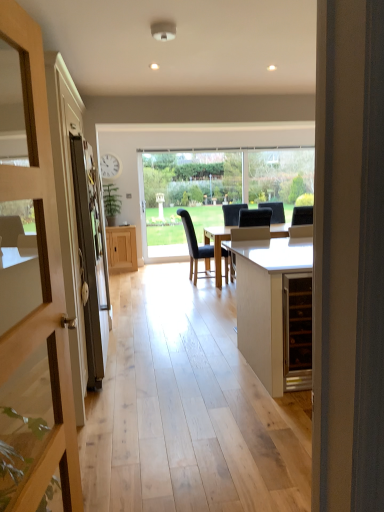
Question: Considering the relative positions of black fabric chair at center and wooden door at left in the image provided, is black fabric chair at center to the right of wooden door at left from the viewer's perspective?

Choices:
 (A) yes
 (B) no

Answer: (A)

Question: Can you confirm if black fabric chair at center is smaller than wooden door at left?

Choices:
 (A) yes
 (B) no

Answer: (B)

Question: Can you confirm if black fabric chair at center is taller than wooden door at left?

Choices:
 (A) no
 (B) yes

Answer: (A)

Question: Does black fabric chair at center touch wooden door at left?

Choices:
 (A) no
 (B) yes

Answer: (A)

Question: From the image's perspective, would you say black fabric chair at center is shown under wooden door at left?

Choices:
 (A) no
 (B) yes

Answer: (A)

Question: From a real-world perspective, is white wood wine cabinet at center, positioned as the 1th cabinetry in right-to-left order, positioned above or below black leather swivel chair at center?

Choices:
 (A) below
 (B) above

Answer: (A)

Question: In the image, is white wood wine cabinet at center, the second cabinetry in the back-to-front sequence, positioned in front of or behind black leather swivel chair at center?

Choices:
 (A) front
 (B) behind

Answer: (A)

Question: Considering the positions of white wood wine cabinet at center, which is the 2th cabinetry from left to right, and black leather swivel chair at center in the image, is white wood wine cabinet at center, which is the 2th cabinetry from left to right, taller or shorter than black leather swivel chair at center?

Choices:
 (A) short
 (B) tall

Answer: (A)

Question: Is point (254, 272) closer or farther from the camera than point (266, 232)?

Choices:
 (A) closer
 (B) farther

Answer: (A)

Question: Does point (132, 233) appear closer or farther from the camera than point (218, 200)?

Choices:
 (A) farther
 (B) closer

Answer: (A)

Question: From a real-world perspective, is wooden cabinet at center, the 2th cabinetry positioned from the front, positioned above or below transparent glass window at center?

Choices:
 (A) below
 (B) above

Answer: (A)

Question: Considering the positions of wooden cabinet at center, the first cabinetry viewed from the back, and transparent glass window at center in the image, is wooden cabinet at center, the first cabinetry viewed from the back, taller or shorter than transparent glass window at center?

Choices:
 (A) short
 (B) tall

Answer: (A)

Question: In terms of width, does wooden cabinet at center, the 2th cabinetry from the right, look wider or thinner when compared to transparent glass window at center?

Choices:
 (A) wide
 (B) thin

Answer: (A)

Question: Is point (87, 301) closer or farther from the camera than point (274, 189)?

Choices:
 (A) closer
 (B) farther

Answer: (A)

Question: From the image's perspective, is matte black screen door at left located above or below transparent glass window at center?

Choices:
 (A) below
 (B) above

Answer: (A)